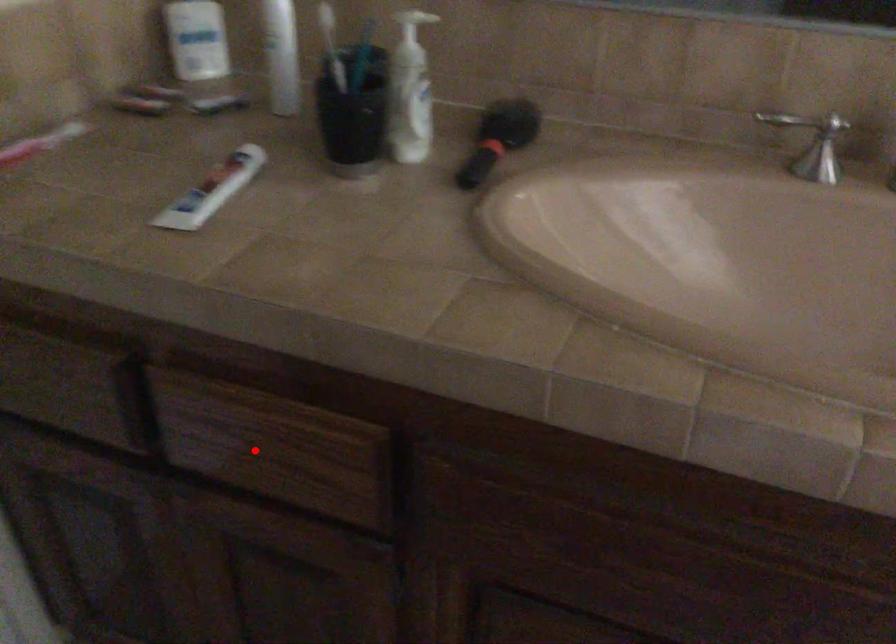
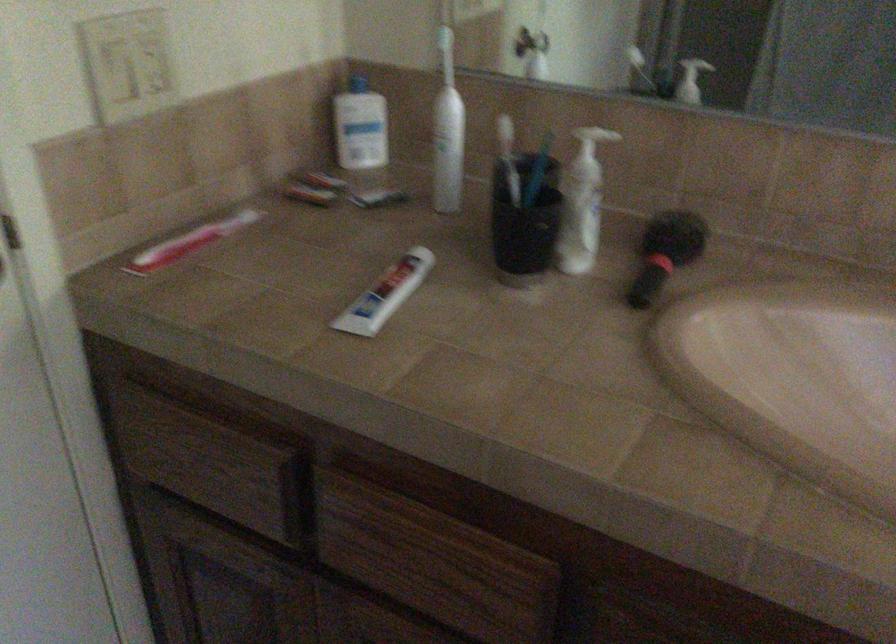
The point at the highlighted location is marked in the first image. Where is the corresponding point in the second image?

(410, 560)